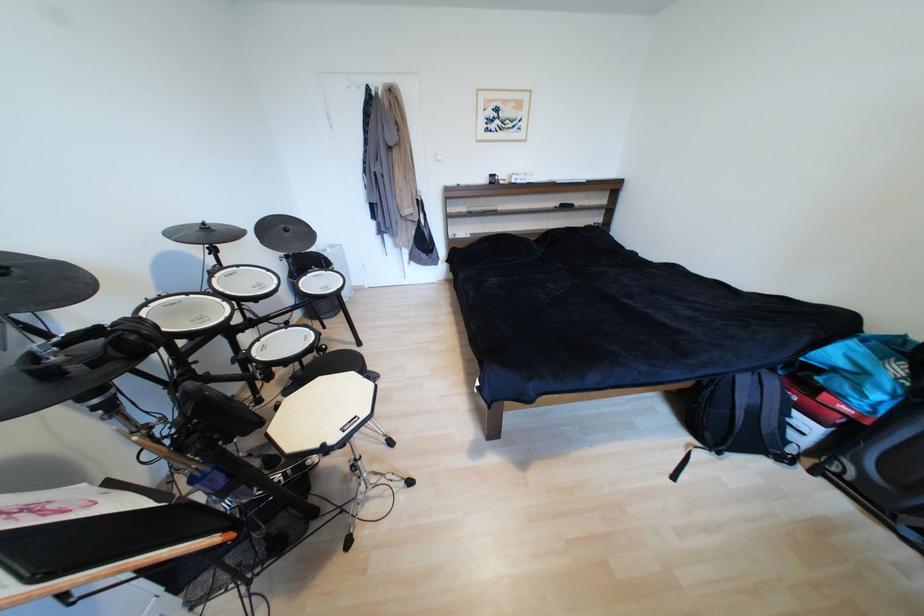
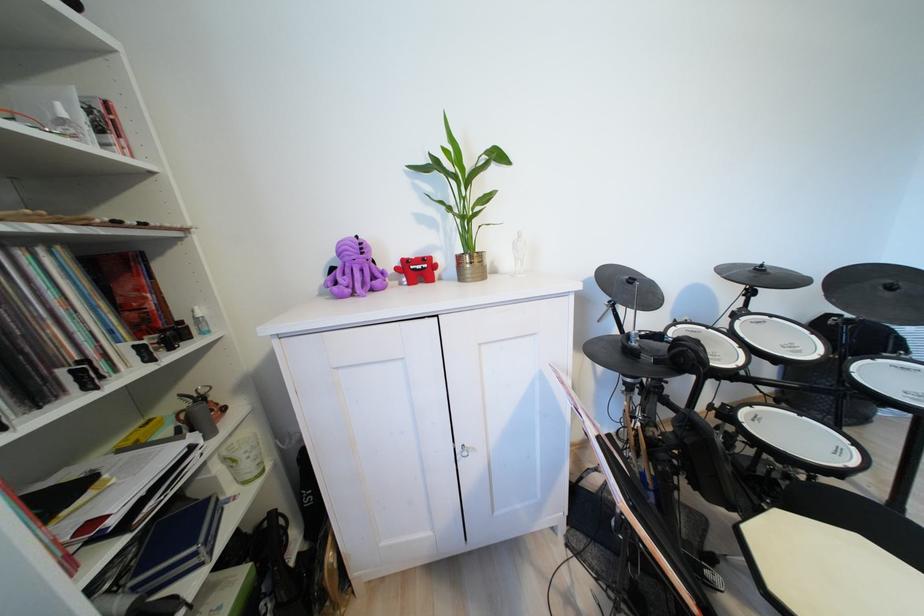
Find the pixel in the second image that matches [211,225] in the first image.

(769, 267)